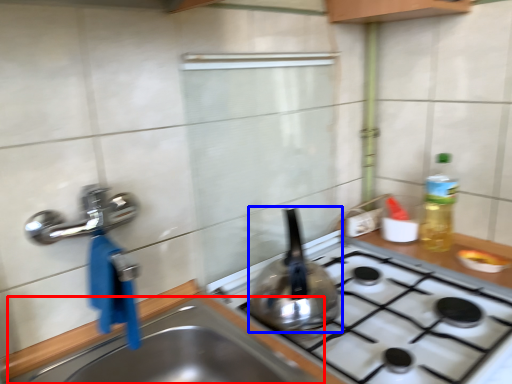
Question: Among these objects, which one is farthest to the camera, sink (highlighted by a red box) or kitchen appliance (highlighted by a blue box)?

Choices:
 (A) sink
 (B) kitchen appliance

Answer: (B)